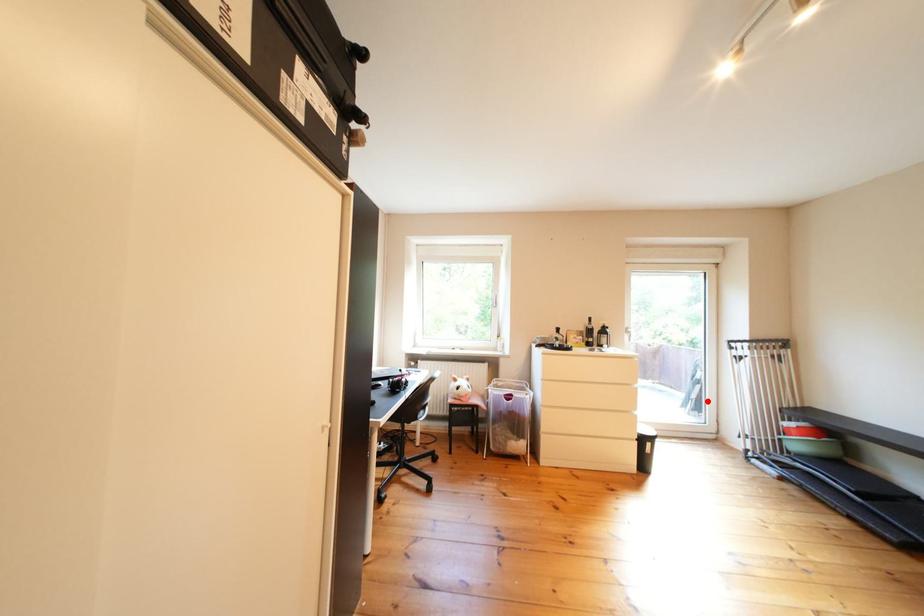
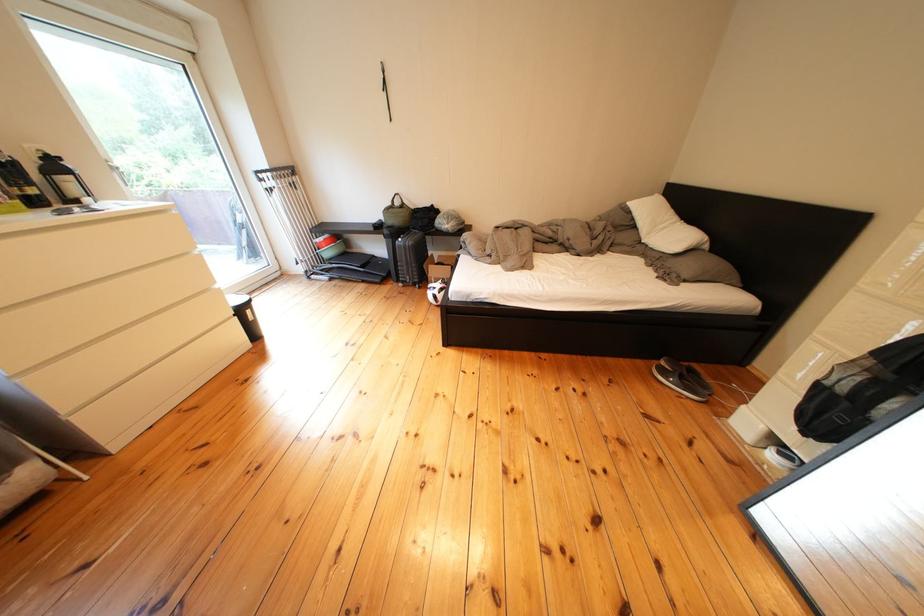
Question: I am providing you with two images of the same scene from different viewpoints. In image1, a red point is highlighted. Considering the same 3D point in image2, which of the following is correct?

Choices:
 (A) It is closer
 (B) It is farther

Answer: (A)